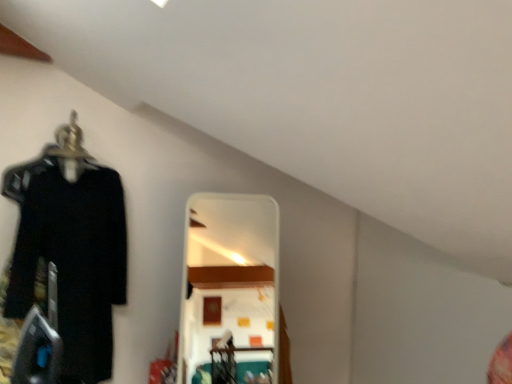
Question: Are black matte shirt at left and metallic silver hanger at left located far from each other?

Choices:
 (A) yes
 (B) no

Answer: (B)

Question: Can you confirm if black matte shirt at left is smaller than metallic silver hanger at left?

Choices:
 (A) no
 (B) yes

Answer: (A)

Question: Does black matte shirt at left have a lesser width compared to metallic silver hanger at left?

Choices:
 (A) no
 (B) yes

Answer: (B)

Question: From a real-world perspective, is black matte shirt at left positioned under metallic silver hanger at left based on gravity?

Choices:
 (A) no
 (B) yes

Answer: (B)

Question: Is metallic silver hanger at left surrounded by black matte shirt at left?

Choices:
 (A) no
 (B) yes

Answer: (A)

Question: Is black matte shirt at left bigger than metallic silver hanger at left?

Choices:
 (A) yes
 (B) no

Answer: (A)

Question: Are metallic silver hanger at left and black matte shirt at left located far from each other?

Choices:
 (A) no
 (B) yes

Answer: (A)

Question: Is metallic silver hanger at left not within black matte shirt at left?

Choices:
 (A) yes
 (B) no

Answer: (A)

Question: Is metallic silver hanger at left looking in the opposite direction of black matte shirt at left?

Choices:
 (A) no
 (B) yes

Answer: (A)

Question: From a real-world perspective, is metallic silver hanger at left under black matte shirt at left?

Choices:
 (A) yes
 (B) no

Answer: (B)

Question: Is metallic silver hanger at left placed right next to black matte shirt at left?

Choices:
 (A) no
 (B) yes

Answer: (A)

Question: Can you confirm if metallic silver hanger at left is positioned to the left of black matte shirt at left?

Choices:
 (A) yes
 (B) no

Answer: (A)

Question: Based on their sizes in the image, would you say black matte shirt at left is bigger or smaller than metallic silver hanger at left?

Choices:
 (A) big
 (B) small

Answer: (A)